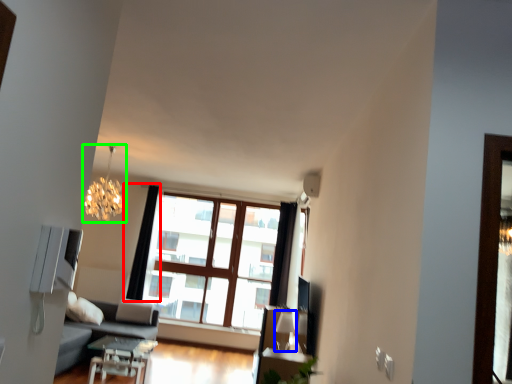
Question: Considering the real-world distances, which object is farthest from curtain (highlighted by a red box)? lamp (highlighted by a blue box) or lamp (highlighted by a green box)?

Choices:
 (A) lamp
 (B) lamp

Answer: (A)